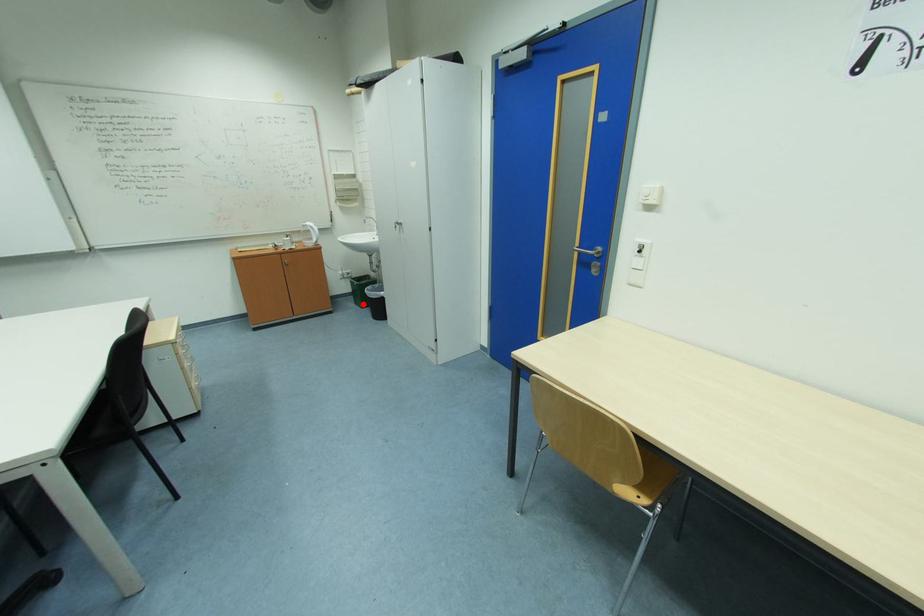
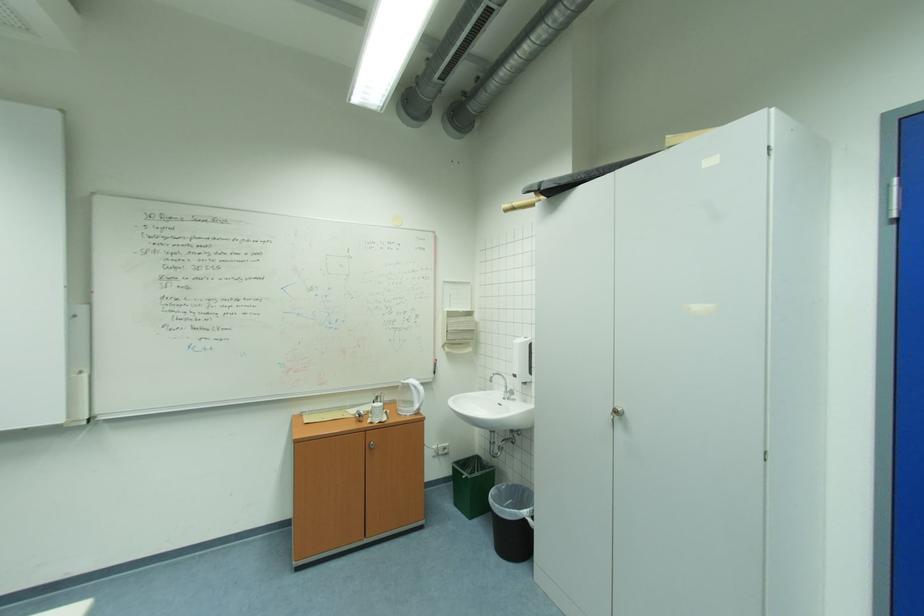
Question: A red point is marked in image1. In image2, is the corresponding 3D point closer to the camera or farther? Reply with the corresponding letter.

Choices:
 (A) The corresponding 3D point is closer.
 (B) The corresponding 3D point is farther.

Answer: (B)